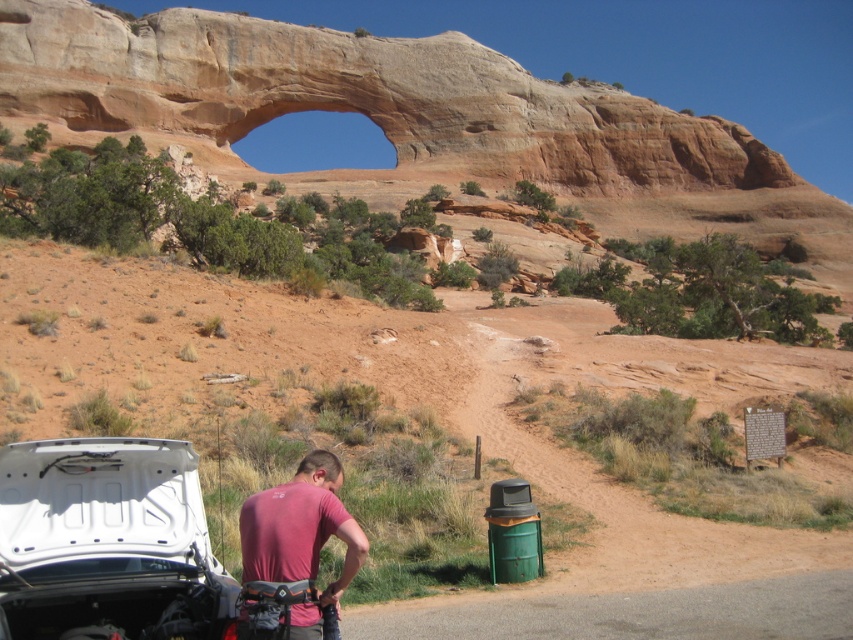
Question: Which point is farther to the camera?

Choices:
 (A) white matte car at lower left
 (B) pink fabric shirt at lower center

Answer: (B)

Question: Which of the following is the closest to the observer?

Choices:
 (A) (286, 538)
 (B) (80, 616)

Answer: (B)

Question: Where is white matte car at lower left located in relation to pink fabric shirt at lower center in the image?

Choices:
 (A) left
 (B) right

Answer: (A)

Question: Does white matte car at lower left have a lesser width compared to pink fabric shirt at lower center?

Choices:
 (A) no
 (B) yes

Answer: (A)

Question: Which object appears farthest from the camera in this image?

Choices:
 (A) pink fabric shirt at lower center
 (B) white matte car at lower left

Answer: (A)

Question: Is white matte car at lower left bigger than pink fabric shirt at lower center?

Choices:
 (A) no
 (B) yes

Answer: (A)